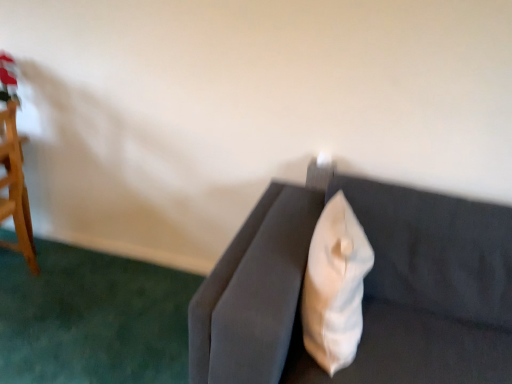
What is the approximate height of white fabric pillow at upper right?

The height of white fabric pillow at upper right is 17.53 inches.

The width and height of the screenshot is (512, 384). Describe the element at coordinates (335, 286) in the screenshot. I see `white fabric pillow at upper right` at that location.

The height and width of the screenshot is (384, 512). What are the coordinates of `white fabric pillow at upper right` in the screenshot? It's located at (335, 286).

Describe the element at coordinates (364, 292) in the screenshot. I see `velvet gray couch at center` at that location.

Locate an element on the screen. velvet gray couch at center is located at coordinates (364, 292).

Where is `white fabric pillow at upper right`? white fabric pillow at upper right is located at coordinates (335, 286).

Is white fabric pillow at upper right at the left side of velvet gray couch at center?

Indeed, white fabric pillow at upper right is positioned on the left side of velvet gray couch at center.

Between white fabric pillow at upper right and velvet gray couch at center, which one is positioned in front?

velvet gray couch at center is closer to the camera.

Which point is more forward, (334, 219) or (480, 323)?

The point (334, 219) is in front.

From the image's perspective, which one is positioned higher, white fabric pillow at upper right or velvet gray couch at center?

white fabric pillow at upper right.

From a real-world perspective, is white fabric pillow at upper right physically located above or below velvet gray couch at center?

white fabric pillow at upper right is situated higher than velvet gray couch at center in the real world.

Which of these two, white fabric pillow at upper right or velvet gray couch at center, is wider?

Wider between the two is velvet gray couch at center.

Does white fabric pillow at upper right have a greater height compared to velvet gray couch at center?

No, white fabric pillow at upper right is not taller than velvet gray couch at center.

Which of these two, white fabric pillow at upper right or velvet gray couch at center, is smaller?

white fabric pillow at upper right is smaller.

Based on the photo, would you say white fabric pillow at upper right is outside velvet gray couch at center?

Actually, white fabric pillow at upper right is within velvet gray couch at center.

Is white fabric pillow at upper right beside velvet gray couch at center?

No, white fabric pillow at upper right is not beside velvet gray couch at center.

Is white fabric pillow at upper right facing away from velvet gray couch at center?

Absolutely, white fabric pillow at upper right is directed away from velvet gray couch at center.

How many degrees apart are the facing directions of white fabric pillow at upper right and velvet gray couch at center?

The facing directions of white fabric pillow at upper right and velvet gray couch at center are 4.06 degrees apart.

Measure the distance between white fabric pillow at upper right and velvet gray couch at center.

They are 18.02 centimeters apart.

Where is `studio couch below the white fabric pillow at upper right (from the image's perspective)`? studio couch below the white fabric pillow at upper right (from the image's perspective) is located at coordinates click(x=364, y=292).

Considering the relative positions of velvet gray couch at center and white fabric pillow at upper right in the image provided, is velvet gray couch at center to the right of white fabric pillow at upper right from the viewer's perspective?

Correct, you'll find velvet gray couch at center to the right of white fabric pillow at upper right.

Considering the relative positions of velvet gray couch at center and white fabric pillow at upper right in the image provided, is velvet gray couch at center in front of white fabric pillow at upper right?

Yes, it is.

In the scene shown: Which point is more forward, [445,277] or [355,231]?

Positioned in front is point [355,231].

From the image's perspective, is velvet gray couch at center above or below white fabric pillow at upper right?

velvet gray couch at center is below white fabric pillow at upper right.

From a real-world perspective, is velvet gray couch at center on white fabric pillow at upper right?

Incorrect, from a real-world perspective, velvet gray couch at center is lower than white fabric pillow at upper right.

Can you confirm if velvet gray couch at center is thinner than white fabric pillow at upper right?

Incorrect, the width of velvet gray couch at center is not less than that of white fabric pillow at upper right.

Considering the relative sizes of velvet gray couch at center and white fabric pillow at upper right in the image provided, is velvet gray couch at center shorter than white fabric pillow at upper right?

No.

Is velvet gray couch at center smaller than white fabric pillow at upper right?

Incorrect, velvet gray couch at center is not smaller in size than white fabric pillow at upper right.

Would you say velvet gray couch at center is outside white fabric pillow at upper right?

Absolutely, velvet gray couch at center is external to white fabric pillow at upper right.

Is velvet gray couch at center next to white fabric pillow at upper right and touching it?

velvet gray couch at center and white fabric pillow at upper right are clearly separated.

Is velvet gray couch at center facing away from white fabric pillow at upper right?

Correct, velvet gray couch at center is looking away from white fabric pillow at upper right.

How many degrees apart are the facing directions of velvet gray couch at center and white fabric pillow at upper right?

The angular difference between velvet gray couch at center and white fabric pillow at upper right is 4.06 degrees.

Image resolution: width=512 pixels, height=384 pixels. I want to click on throw pillow behind the velvet gray couch at center, so (x=335, y=286).

In order to click on studio couch lying on the right of white fabric pillow at upper right in this screenshot , I will do `click(364, 292)`.

Image resolution: width=512 pixels, height=384 pixels. I want to click on throw pillow to the left of velvet gray couch at center, so click(335, 286).